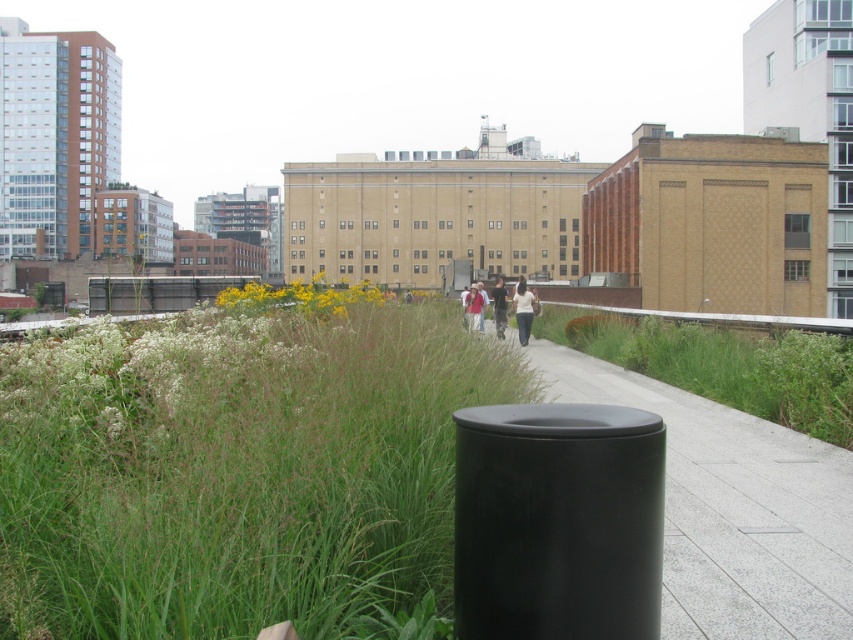
You are a delivery drone flying over the rooftop garden. You need to land on the black concrete pavement at center while avoiding the dark blue shirt at center. Can you safely land there?

The black concrete pavement at center is thinner than dark blue shirt at center, so there might not be enough space to land safely. Choose another location.

You are a fashion designer observing two jackets displayed on mannequins in a rooftop garden. The jackets are the white matte jacket at center and the light brown leather jacket at center. Which jacket appears taller when viewed from your position?

The white matte jacket at center appears taller than the light brown leather jacket at center.